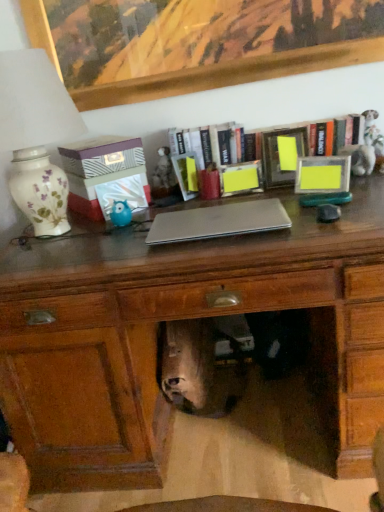
Identify the location of free space to the right of matte blue plastic owl at center-left. This screenshot has width=384, height=512. (144, 219).